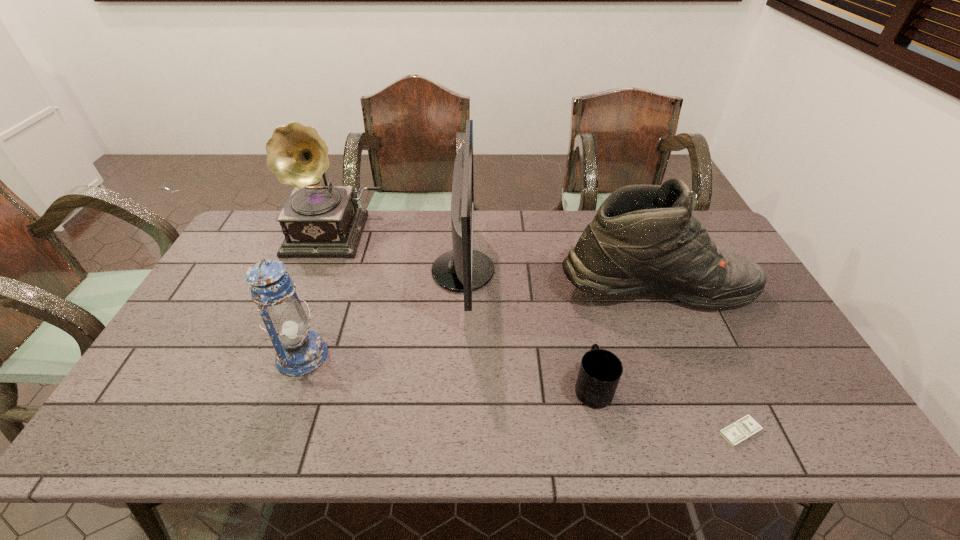
Find the location of a particular element. unoccupied position between the lantern and the nearest object is located at coordinates (520, 394).

Where is `vacant space in between the mug and the ski boot`? vacant space in between the mug and the ski boot is located at coordinates (624, 338).

Locate an element on the screen. Image resolution: width=960 pixels, height=540 pixels. object that ranks as the closest to the mug is located at coordinates (644, 237).

I want to click on object identified as the fourth closest to the nearest object, so click(x=299, y=351).

Image resolution: width=960 pixels, height=540 pixels. Find the location of `vacant position in the image that satisfies the following two spatial constraints: 1. on the front-facing side of the lantern; 2. on the left side of the nearest object`. vacant position in the image that satisfies the following two spatial constraints: 1. on the front-facing side of the lantern; 2. on the left side of the nearest object is located at coordinates (275, 432).

Identify the location of vacant space that satisfies the following two spatial constraints: 1. on the side of the fifth tallest object with the handle; 2. on the screen side of the monitor. Image resolution: width=960 pixels, height=540 pixels. (567, 271).

I want to click on vacant space that satisfies the following two spatial constraints: 1. on the horn of the money; 2. on the left side of the record player, so click(x=257, y=432).

At what (x,y) coordinates should I click in order to perform the action: click on vacant region that satisfies the following two spatial constraints: 1. on the front-facing side of the lantern; 2. on the side of the second shortest object with the handle. Please return your answer as a coordinate pair (x, y). This screenshot has height=540, width=960. Looking at the image, I should click on (290, 388).

Where is `vacant space that satisfies the following two spatial constraints: 1. on the side of the second shortest object with the handle; 2. on the right side of the ski boot`? Image resolution: width=960 pixels, height=540 pixels. vacant space that satisfies the following two spatial constraints: 1. on the side of the second shortest object with the handle; 2. on the right side of the ski boot is located at coordinates (571, 287).

Where is `free spot that satisfies the following two spatial constraints: 1. on the screen side of the nearest object; 2. on the left side of the monitor`? This screenshot has width=960, height=540. free spot that satisfies the following two spatial constraints: 1. on the screen side of the nearest object; 2. on the left side of the monitor is located at coordinates (456, 432).